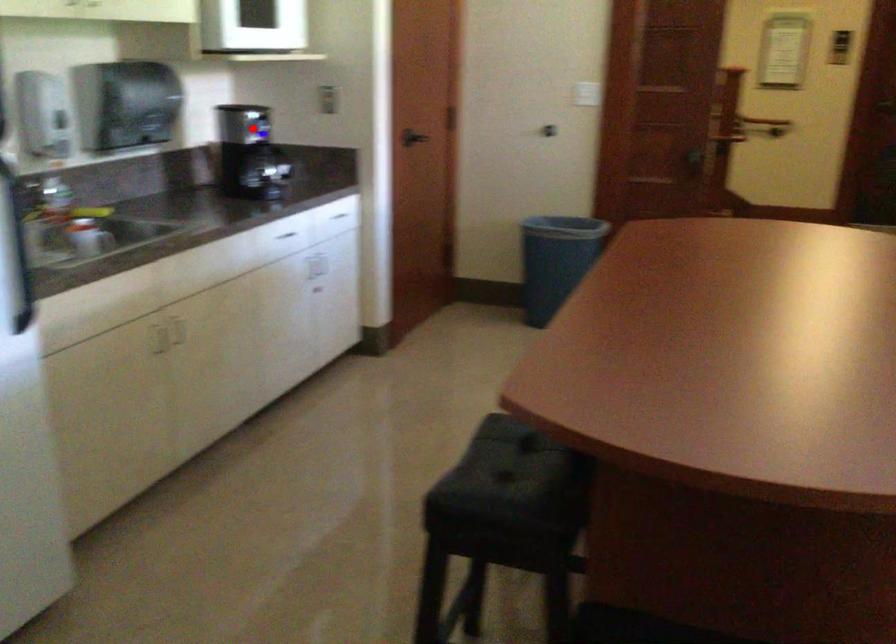
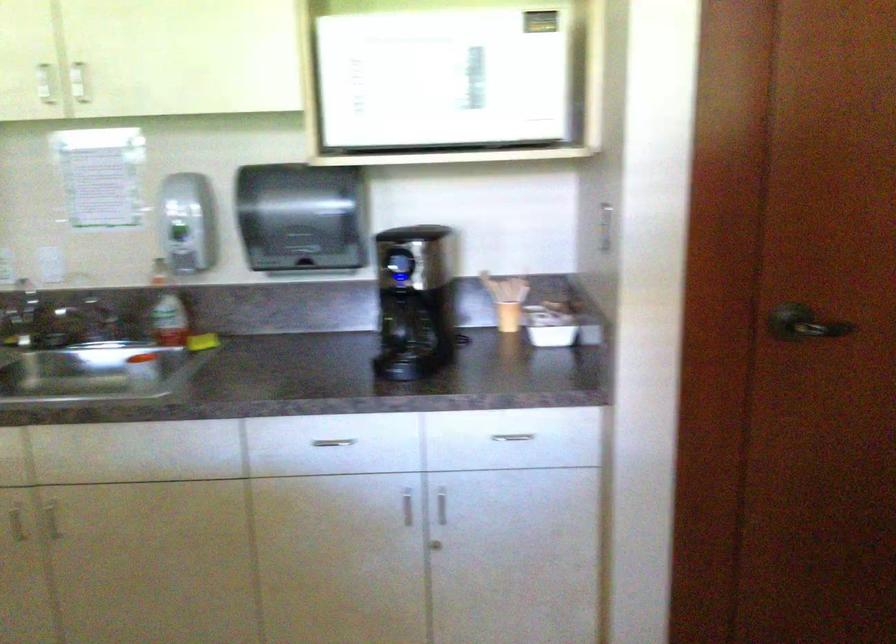
In the second image, find the point that corresponds to the highlighted location in the first image.

(399, 263)